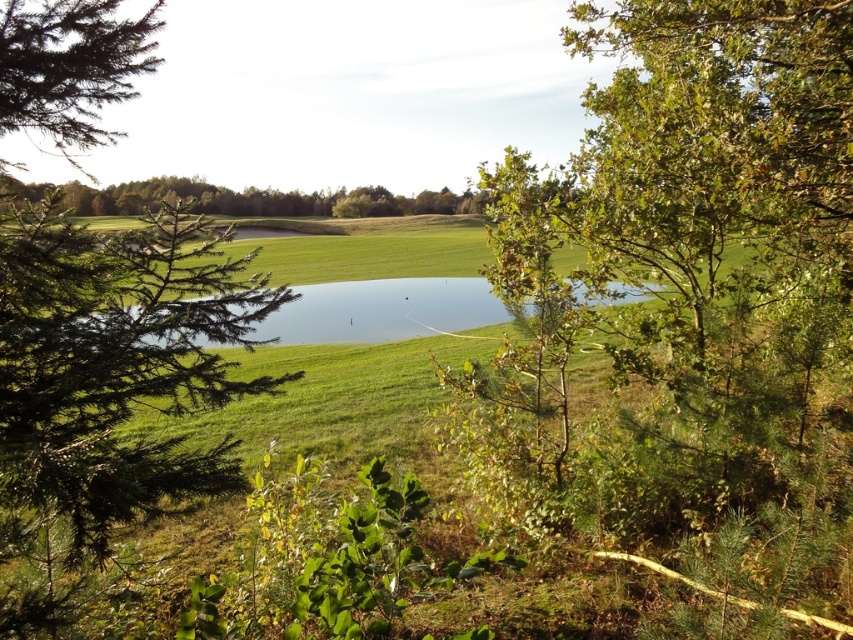
Question: Can you confirm if green needle-like tree at left is positioned above green needle-like at upper left?

Choices:
 (A) no
 (B) yes

Answer: (A)

Question: Is green needle-like tree at left smaller than green needle-like at upper left?

Choices:
 (A) yes
 (B) no

Answer: (B)

Question: Observing the image, what is the correct spatial positioning of green needle-like tree at left in reference to clear water at center?

Choices:
 (A) right
 (B) left

Answer: (B)

Question: Among these objects, which one is farthest from the camera?

Choices:
 (A) green needle-like at upper left
 (B) clear water at center

Answer: (B)

Question: Estimate the real-world distances between objects in this image. Which object is farther from the clear water at center?

Choices:
 (A) green needle-like tree at left
 (B) green needle-like at upper left

Answer: (B)

Question: Which of the following is the farthest from the observer?

Choices:
 (A) (131, 266)
 (B) (424, 280)

Answer: (B)